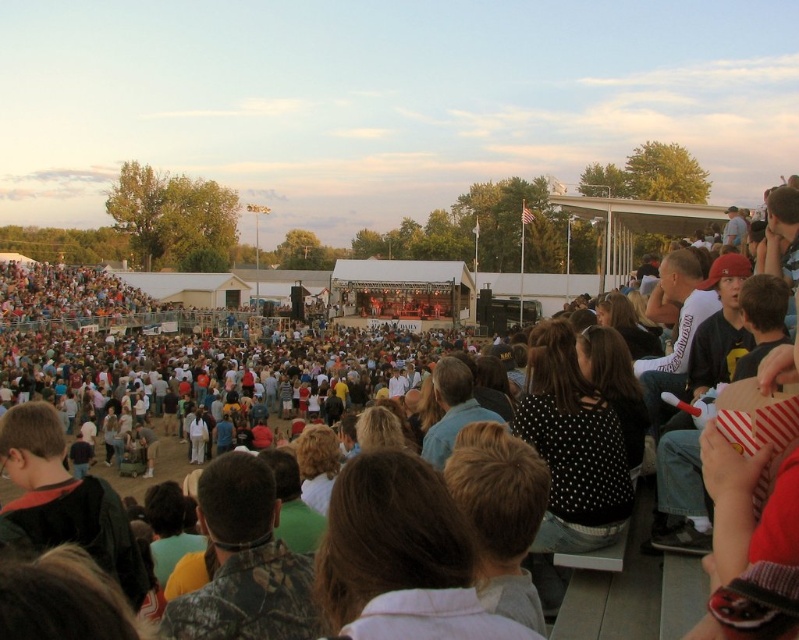
Question: Can you confirm if matte black stage at center is wider than dark brown hair at center?

Choices:
 (A) no
 (B) yes

Answer: (B)

Question: Which of the following is the closest to the observer?

Choices:
 (A) (289, 385)
 (B) (201, 445)

Answer: (B)

Question: Does brown hair at center appear on the left side of dark blue jacket at lower left?

Choices:
 (A) no
 (B) yes

Answer: (A)

Question: Which of the following is the closest to the observer?

Choices:
 (A) (432, 579)
 (B) (80, 538)
 (C) (261, 502)
 (D) (229, 364)

Answer: (A)

Question: Is dark blue jacket at lower left bigger than dark brown hair at center?

Choices:
 (A) no
 (B) yes

Answer: (B)

Question: Which object is closer to the camera taking this photo?

Choices:
 (A) brown hair at center
 (B) dark brown hair at center
 (C) dark blue jacket at lower left

Answer: (A)